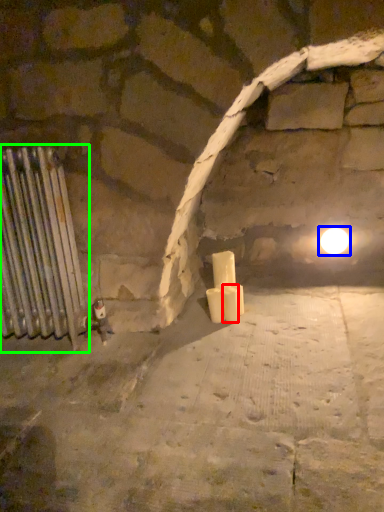
Question: Which is nearer to the candle (highlighted by a red box)? light (highlighted by a blue box) or radiator (highlighted by a green box).

Choices:
 (A) light
 (B) radiator

Answer: (A)